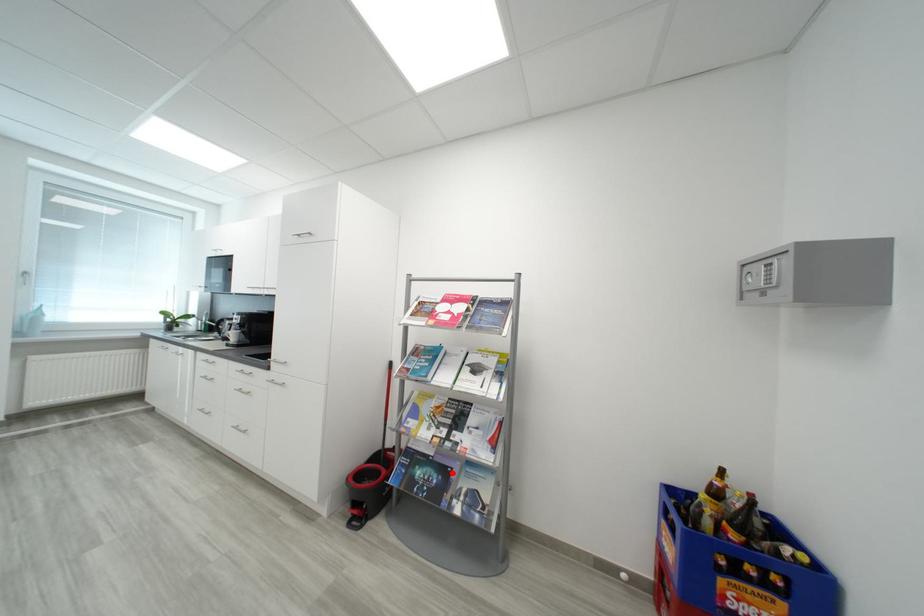
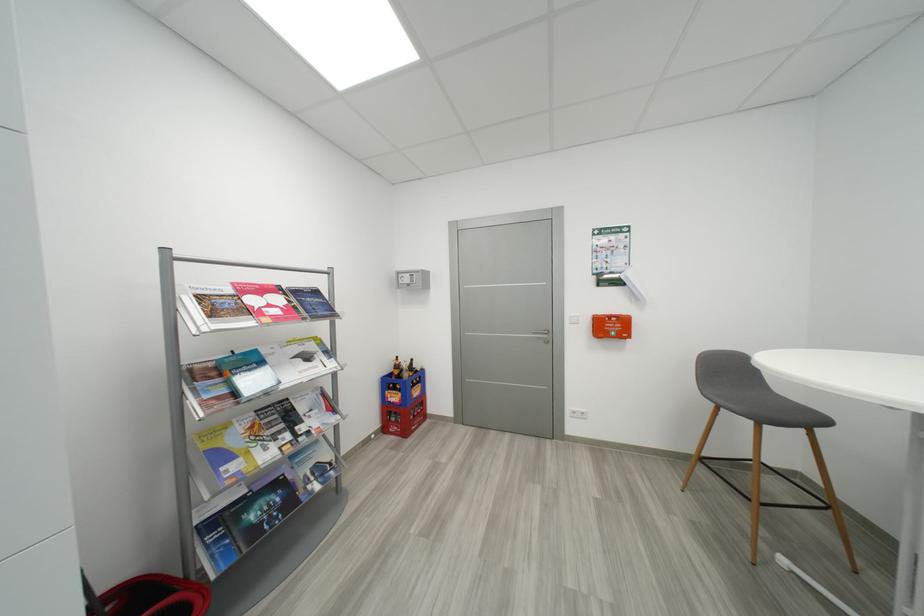
The point at the highlighted location is marked in the first image. Where is the corresponding point in the second image?

(285, 485)